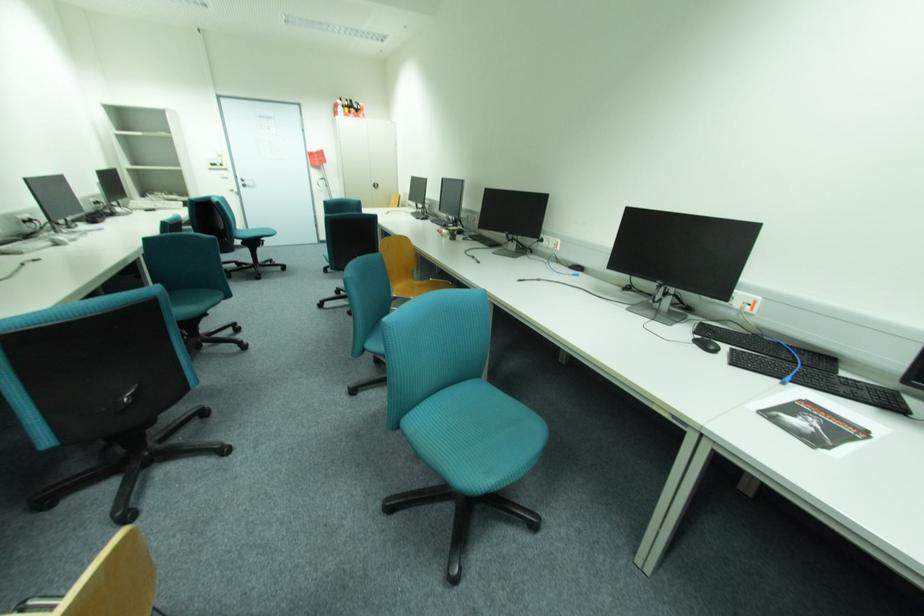
Locate an element on the screen. Image resolution: width=924 pixels, height=616 pixels. chair adjustment knob is located at coordinates (123, 400).